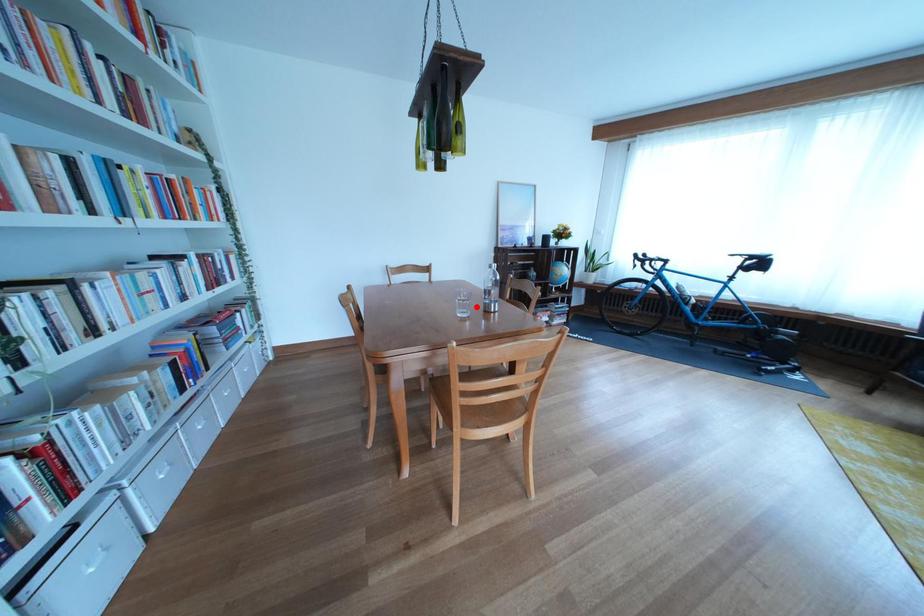
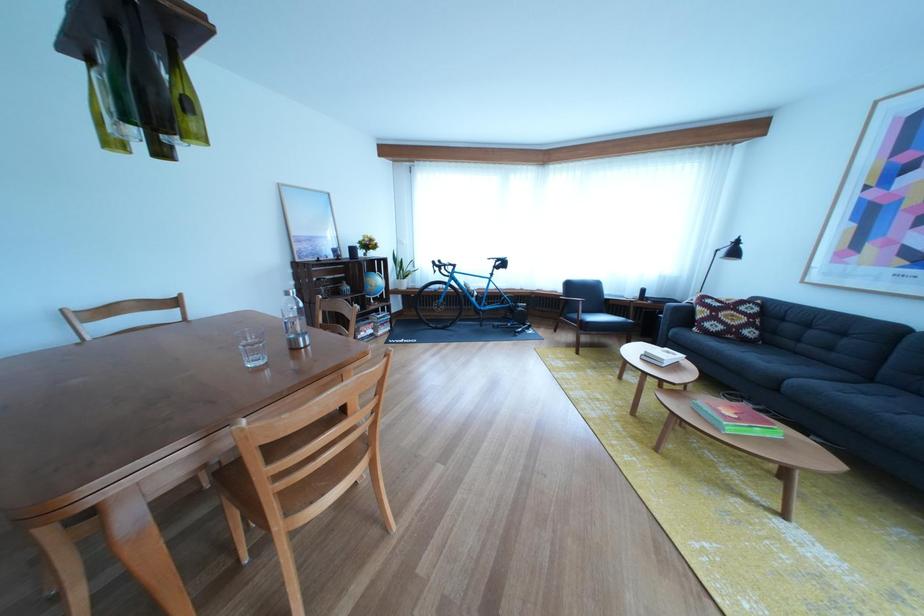
In the second image, find the point that corresponds to the highlighted location in the first image.

(265, 351)